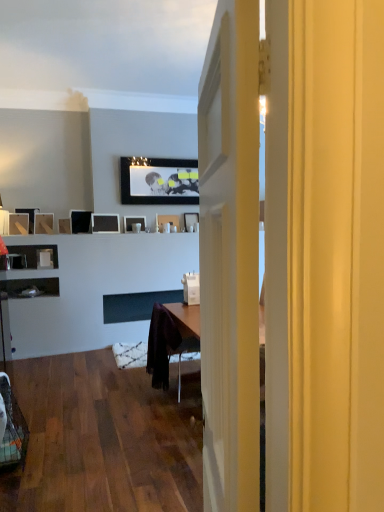
The width and height of the screenshot is (384, 512). I want to click on vacant space underneath matte wood picture frame at left, which is counted as the eighth picture frame, starting from the right (from a real-world perspective), so click(x=48, y=347).